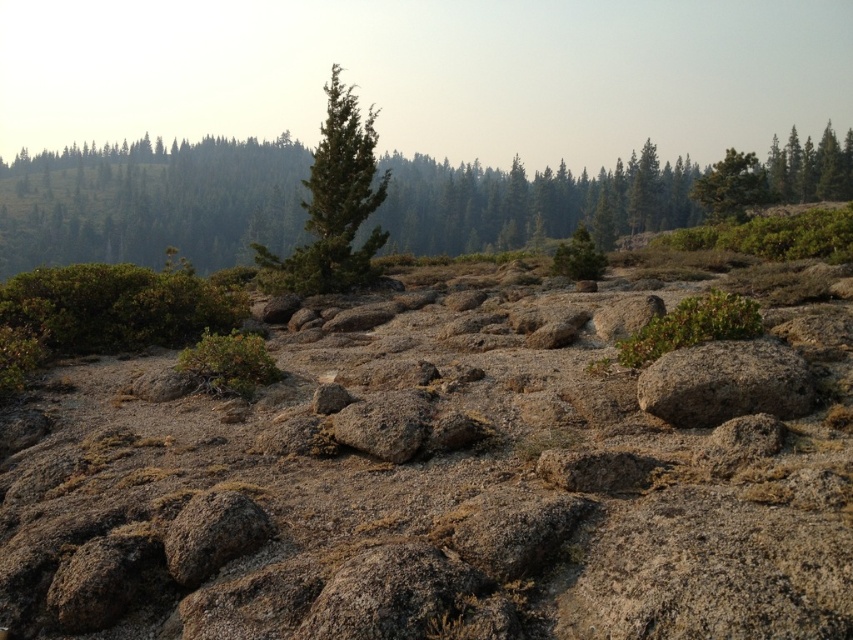
You are a hiker planning to set up a tent in this rocky area. You notice the green textured pine trees at upper center and the green matte tree at center. Which tree would provide more shade if you place your tent under it?

The green textured pine trees at upper center would provide more shade because they are taller than the green matte tree at center.

You are a hiker navigating the rugged terrain and want to place a marker between the two points, point [607,225] and point [741,392]. Which point is closer to you so you can start placing the marker from there?

Point [741,392] is closer to you, so you should start placing the marker from there since it is nearer than point [607,225] which is further away.